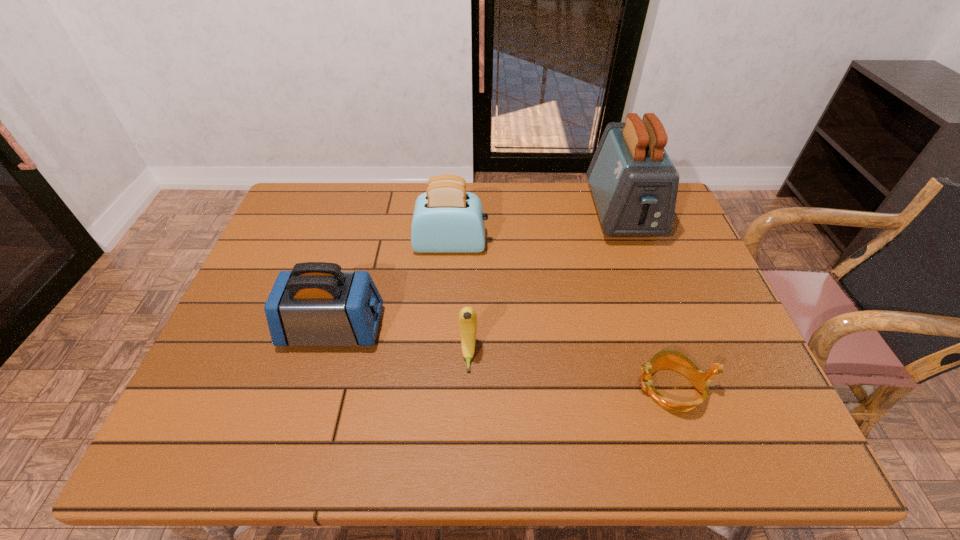
Locate an element on the screen. The width and height of the screenshot is (960, 540). the tallest object is located at coordinates (634, 184).

Locate an element on the screen. The width and height of the screenshot is (960, 540). the tallest toaster is located at coordinates (634, 184).

Locate an element on the screen. the second toaster from left to right is located at coordinates (446, 219).

You are a GUI agent. You are given a task and a screenshot of the screen. Output one action in this format:
    pyautogui.click(x=<x>, y=<y>)
    Task: Click on the nearest toaster
    The image size is (960, 540).
    Given the screenshot: What is the action you would take?
    pyautogui.click(x=316, y=304)

Find the location of `the leftmost object`. the leftmost object is located at coordinates (316, 304).

Where is `the fourth tallest object`? the fourth tallest object is located at coordinates (467, 316).

Where is `tiara`? The image size is (960, 540). tiara is located at coordinates (672, 359).

The height and width of the screenshot is (540, 960). I want to click on vacant region located 0.380m on the front-facing side of the rightmost toaster, so (x=675, y=360).

Where is `free region located 0.060m on the side of the second toaster from left to right with the lever`? This screenshot has height=540, width=960. free region located 0.060m on the side of the second toaster from left to right with the lever is located at coordinates (508, 245).

The height and width of the screenshot is (540, 960). I want to click on free space located 0.300m on the front-facing side of the nearest toaster, so click(504, 328).